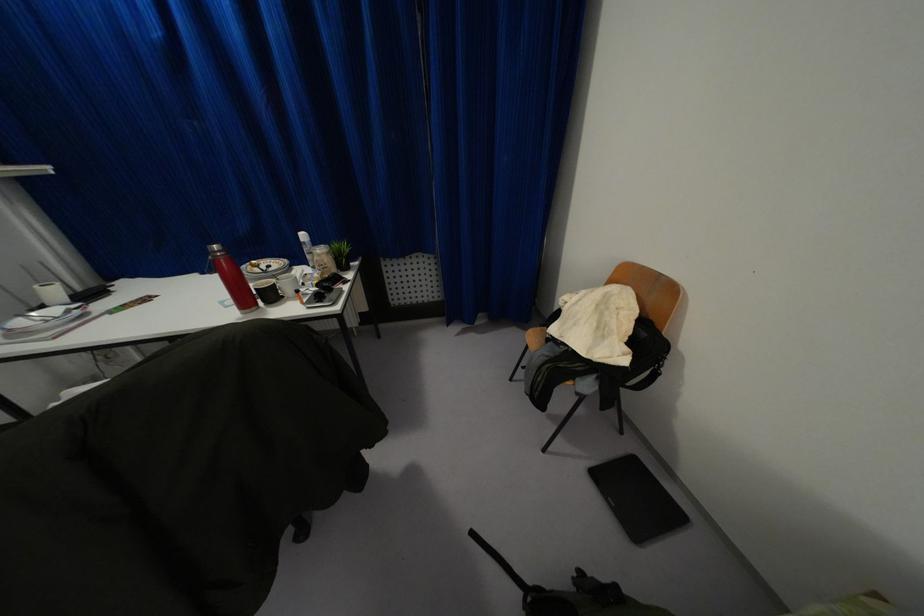
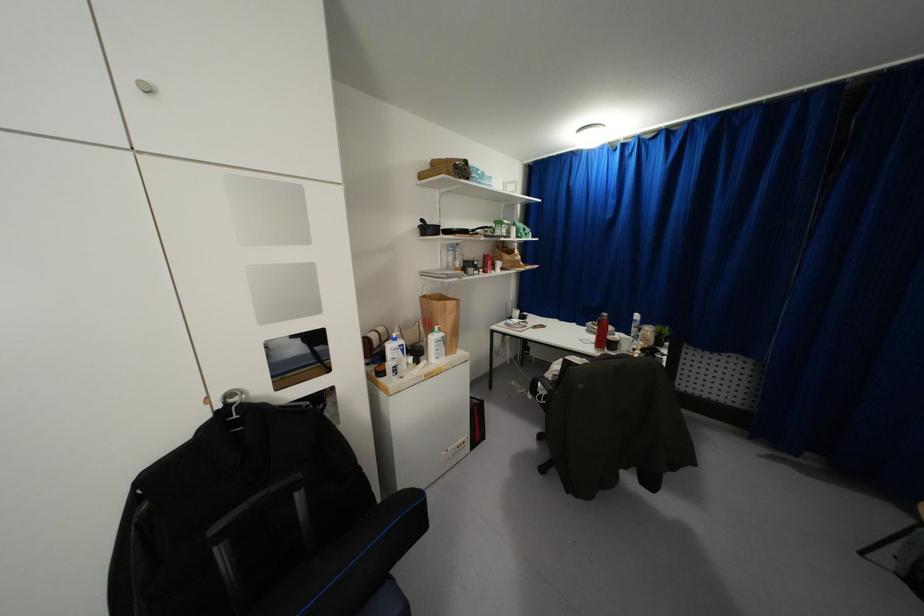
Question: I am providing you with two images of the same scene from different viewpoints. After the viewpoint changes to image2, which objects are now occluded?

Choices:
 (A) brown paper bag
 (B) small plant pot
 (C) silver cabinet knob
 (D) none of these

Answer: (D)